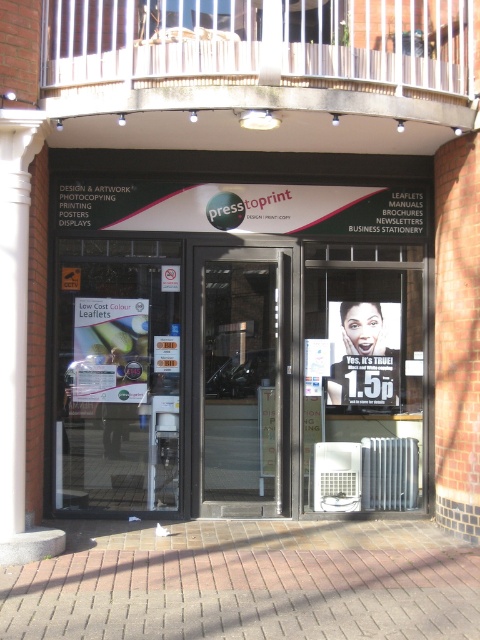
Is point (80, 188) closer to camera compared to point (462, 561)?

That is False.

Is white glossy signboard at center closer to camera compared to brick pavement at lower center?

No, white glossy signboard at center is behind brick pavement at lower center.

Is point (219, 300) positioned before point (373, 522)?

No, (219, 300) is further to viewer.

Where is `white glossy signboard at center`? white glossy signboard at center is located at coordinates (239, 337).

Is transparent glass door at center to the right of matte paper leaflets at center from the viewer's perspective?

Correct, you'll find transparent glass door at center to the right of matte paper leaflets at center.

How much distance is there between transparent glass door at center and matte paper leaflets at center?

transparent glass door at center and matte paper leaflets at center are 1.10 meters apart.

Measure the distance between point (253, 314) and camera.

8.90 meters

Find the location of a particular element. transparent glass door at center is located at coordinates (244, 381).

In order to click on metallic air conditioner at center in this screenshot , I will do `click(363, 372)`.

Between metallic air conditioner at center and matte plastic poster at center, which one appears on the left side from the viewer's perspective?

From the viewer's perspective, metallic air conditioner at center appears more on the left side.

Between point (311, 259) and point (348, 401), which one is positioned behind?

The point (348, 401) is more distant.

Locate an element on the screen. Image resolution: width=480 pixels, height=640 pixels. metallic air conditioner at center is located at coordinates (363, 372).